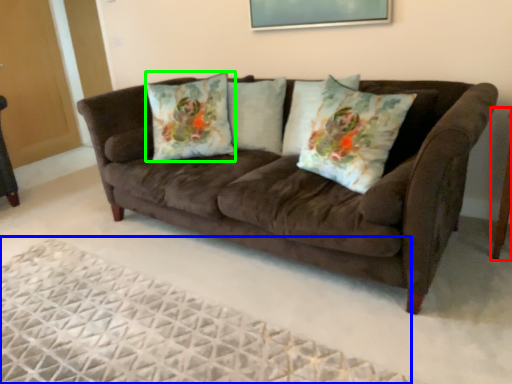
Question: Based on their relative distances, which object is nearer to side table (highlighted by a red box)? Choose from plain (highlighted by a blue box) and throw pillow (highlighted by a green box).

Choices:
 (A) plain
 (B) throw pillow

Answer: (A)